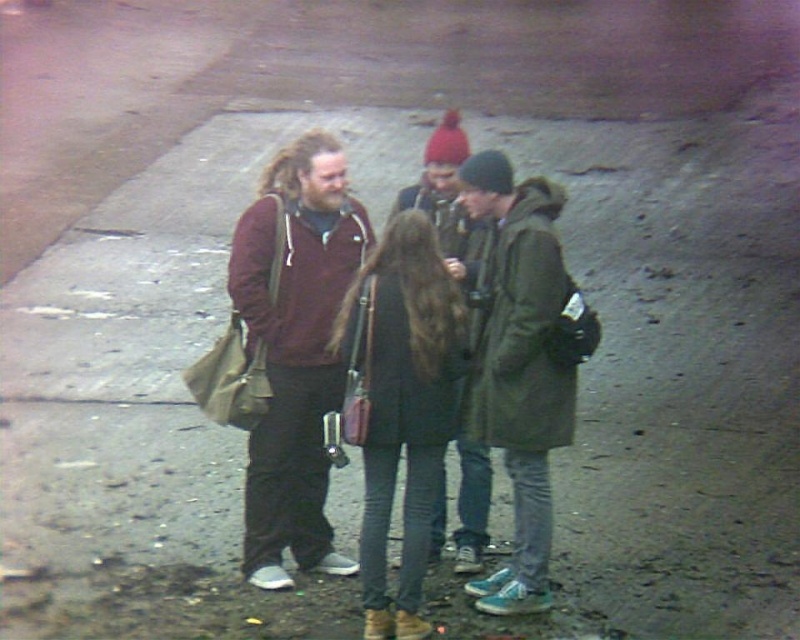
In the scene shown: Can you confirm if green matte coat at center is taller than dark green textured coat at center?

Correct, green matte coat at center is much taller as dark green textured coat at center.

You are a GUI agent. You are given a task and a screenshot of the screen. Output one action in this format:
    pyautogui.click(x=<x>, y=<y>)
    Task: Click on the green matte coat at center
    This screenshot has height=640, width=800.
    Given the screenshot: What is the action you would take?
    pyautogui.click(x=522, y=364)

Which is behind, point (494, 337) or point (458, 212)?

The point (458, 212) is behind.

At what (x,y) coordinates should I click in order to perform the action: click on green matte coat at center. Please return your answer as a coordinate pair (x, y). Looking at the image, I should click on (522, 364).

Does maroon fleece jacket at center come behind dark green textured coat at center?

Yes.

Does maroon fleece jacket at center lie in front of dark green textured coat at center?

That is False.

Is point (336, 186) in front of point (462, 221)?

Yes, it is in front of point (462, 221).

The image size is (800, 640). Find the location of `maroon fleece jacket at center`. maroon fleece jacket at center is located at coordinates (296, 349).

Does green matte coat at center lie behind dark green leather jacket at center?

Yes, green matte coat at center is behind dark green leather jacket at center.

The width and height of the screenshot is (800, 640). What do you see at coordinates (522, 364) in the screenshot?
I see `green matte coat at center` at bounding box center [522, 364].

The image size is (800, 640). Find the location of `green matte coat at center`. green matte coat at center is located at coordinates (522, 364).